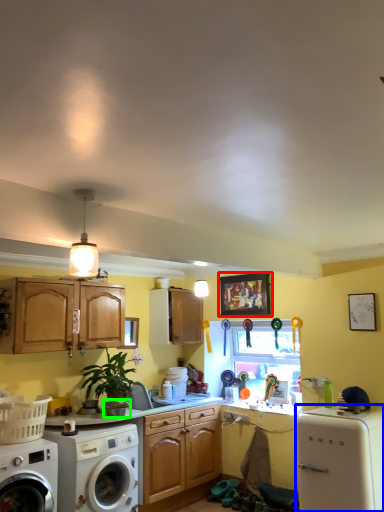
Question: Which is farther away from picture frame (highlighted by a red box)? dish washer (highlighted by a blue box) or appliance (highlighted by a green box)?

Choices:
 (A) dish washer
 (B) appliance

Answer: (B)